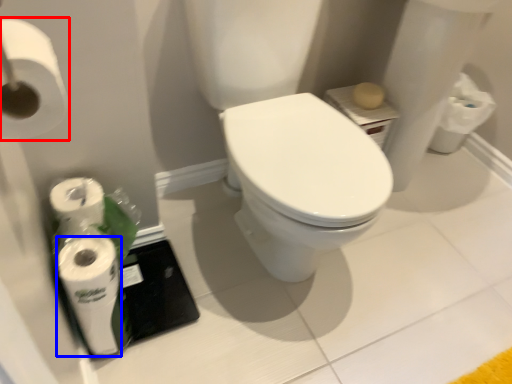
Question: Among these objects, which one is nearest to the camera, toilet paper (highlighted by a red box) or toilet paper (highlighted by a blue box)?

Choices:
 (A) toilet paper
 (B) toilet paper

Answer: (A)